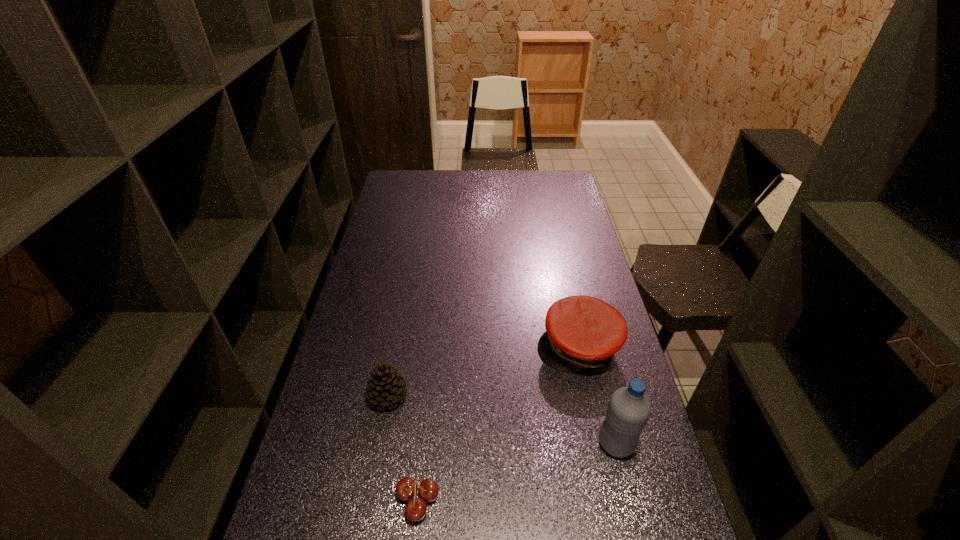
Identify the location of vacant point located between the cap and the leftmost object. The image size is (960, 540). click(483, 371).

Identify the location of empty location between the third object from right to left and the cap. (498, 422).

You are a GUI agent. You are given a task and a screenshot of the screen. Output one action in this format:
    pyautogui.click(x=<x>, y=<y>)
    Task: Click on the free space between the cap and the water bottle
    This screenshot has height=540, width=960.
    Given the screenshot: What is the action you would take?
    pyautogui.click(x=597, y=395)

Locate an element on the screen. This screenshot has width=960, height=540. free space between the pinecone and the water bottle is located at coordinates (502, 419).

Identify the location of vacant area between the farthest object and the pinecone. (483, 371).

Where is `free point between the nearest object and the third farthest object`? Image resolution: width=960 pixels, height=540 pixels. free point between the nearest object and the third farthest object is located at coordinates (517, 470).

At what (x,y) coordinates should I click in order to perform the action: click on vacant space that's between the farthest object and the water bottle. Please return your answer as a coordinate pair (x, y). Looking at the image, I should click on (597, 395).

Identify the location of unoccupied position between the third object from right to left and the pinecone. (403, 447).

Locate an element on the screen. Image resolution: width=960 pixels, height=540 pixels. object that ranks as the third closest to the second nearest object is located at coordinates (385, 387).

Locate an element on the screen. object that is the closest to the third nearest object is located at coordinates click(406, 488).